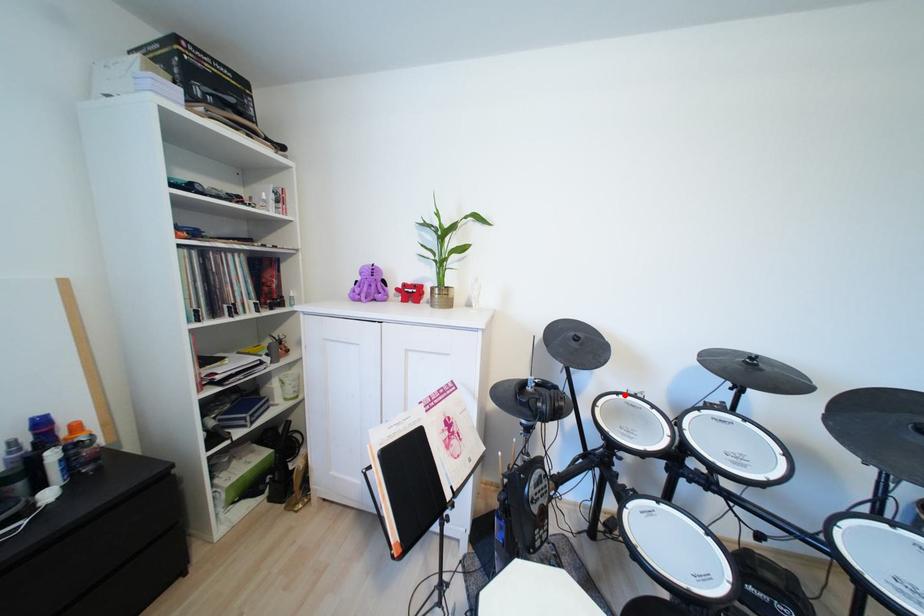
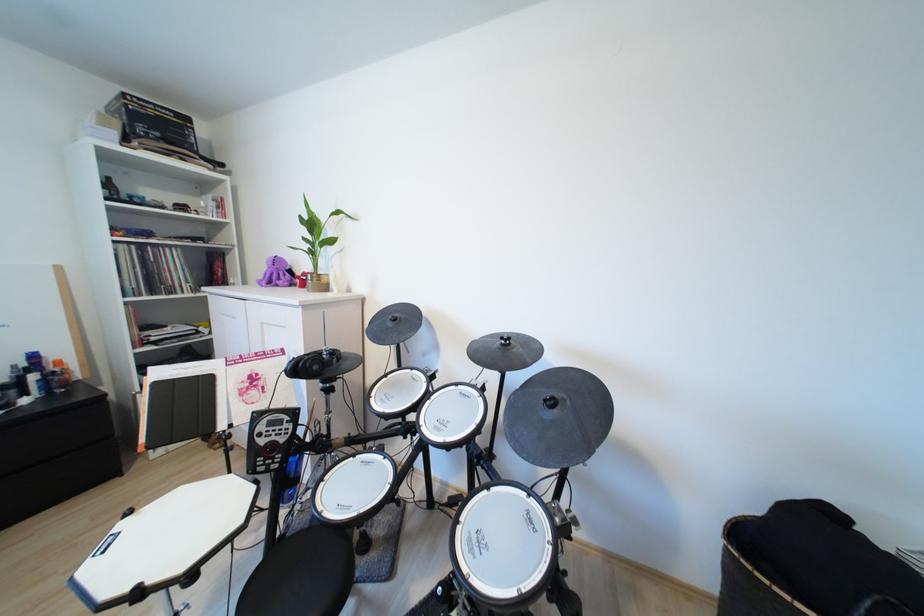
In the second image, find the point that corresponds to the highlighted location in the first image.

(419, 370)